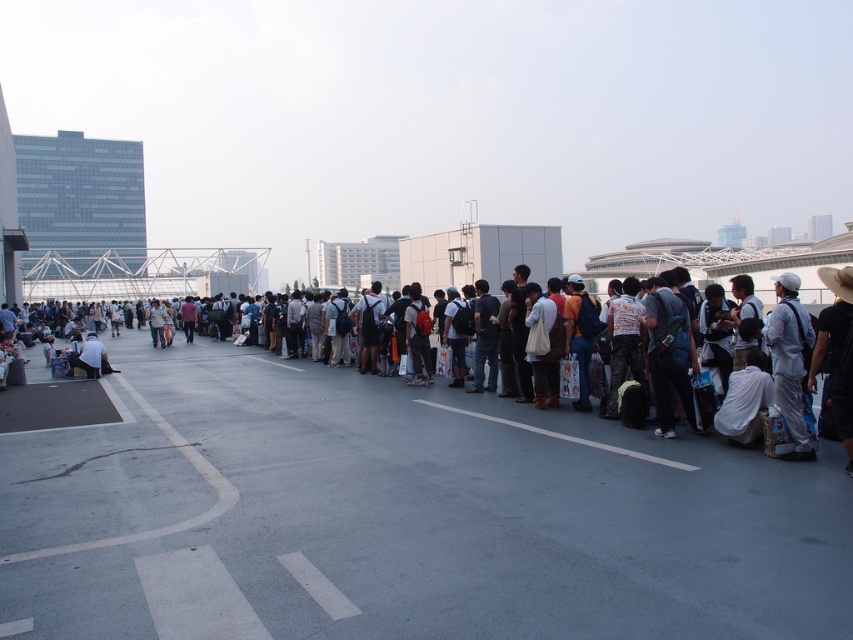
Can you confirm if dark gray backpack at center is shorter than white fabric bag at right?

Incorrect, dark gray backpack at center's height does not fall short of white fabric bag at right's.

What do you see at coordinates (364, 445) in the screenshot? Image resolution: width=853 pixels, height=640 pixels. I see `dark gray backpack at center` at bounding box center [364, 445].

Is point (184, 448) positioned before point (799, 387)?

That is False.

In order to click on dark gray backpack at center in this screenshot , I will do `click(364, 445)`.

This screenshot has height=640, width=853. What do you see at coordinates (364, 445) in the screenshot? I see `dark gray backpack at center` at bounding box center [364, 445].

Based on the photo, who is positioned more to the right, dark gray backpack at center or black fabric bag at center?

black fabric bag at center

Where is `dark gray backpack at center`? This screenshot has height=640, width=853. dark gray backpack at center is located at coordinates (364, 445).

Can you confirm if white fabric bag at right is shorter than light brown leather jacket at lower left?

No.

Does point (807, 316) lie in front of point (102, 346)?

Yes, point (807, 316) is closer to viewer.

Describe the element at coordinates (788, 358) in the screenshot. This screenshot has height=640, width=853. I see `white fabric bag at right` at that location.

The image size is (853, 640). Find the location of `white fabric bag at right`. white fabric bag at right is located at coordinates (788, 358).